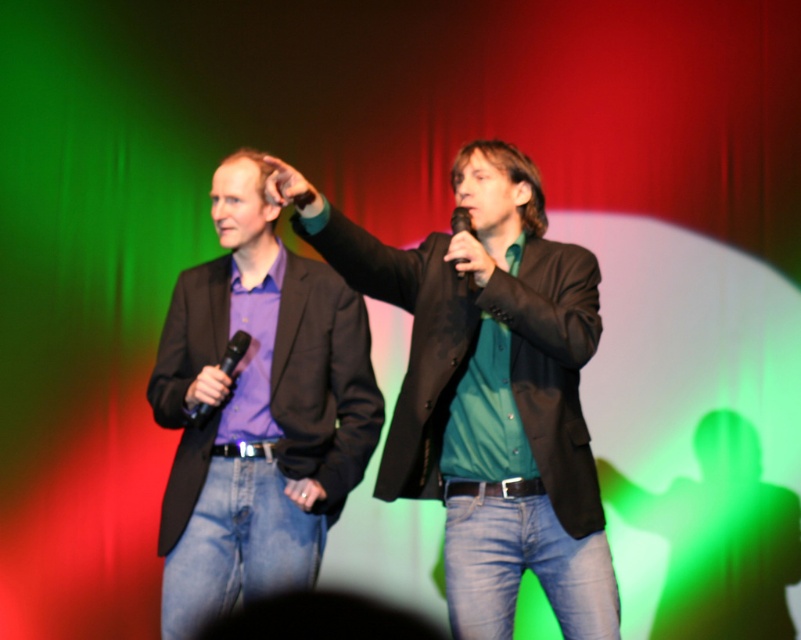
Question: Is black matte microphone at left behind black matte microphone at upper center?

Choices:
 (A) no
 (B) yes

Answer: (B)

Question: Which point is farther to the camera?

Choices:
 (A) (465, 214)
 (B) (529, 458)
 (C) (212, 406)
 (D) (230, 371)

Answer: (D)

Question: Which object is the farthest from the black matte microphone at left?

Choices:
 (A) purple matte shirt at left
 (B) green matte shirt at center
 (C) black matte microphone at upper center

Answer: (B)

Question: Does purple matte shirt at left appear over black matte microphone at left?

Choices:
 (A) no
 (B) yes

Answer: (A)

Question: Which of the following is the farthest from the observer?

Choices:
 (A) green matte shirt at center
 (B) black matte microphone at left
 (C) purple matte shirt at left

Answer: (B)

Question: Can you confirm if black matte microphone at left is thinner than black matte microphone at upper center?

Choices:
 (A) no
 (B) yes

Answer: (A)